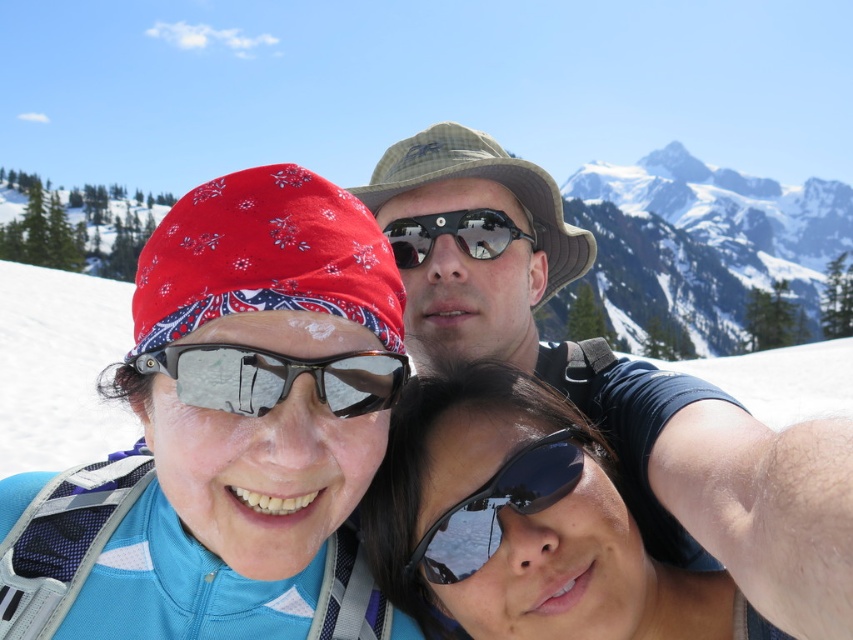
You are a photographer trying to capture the camouflage fabric hat at center and the sunglasses at center in a single shot. Based on their positions, which object is more likely to be fully visible in the frame?

The camouflage fabric hat at center is wider than sunglasses at center, so it might be more likely to be fully visible in the frame.

You are a photographer trying to capture the perfect shot of the transparent plastic goggles at center and the black reflective sunglasses at center. Which object should you focus on first if you want to ensure both are in sharp focus?

The transparent plastic goggles at center is located above the black reflective sunglasses at center, so focusing on the goggles first will help ensure both are in focus as they are vertically aligned.